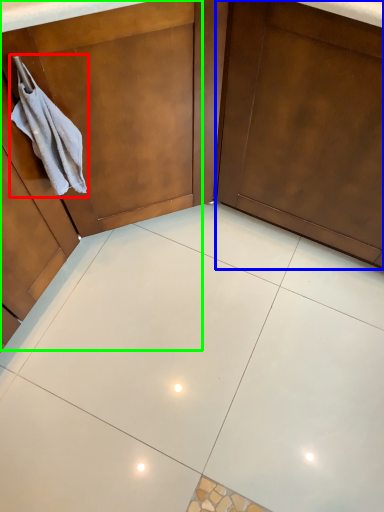
Question: Estimate the real-world distances between objects in this image. Which object is farther from hand towel (highlighted by a red box), door (highlighted by a blue box) or dresser (highlighted by a green box)?

Choices:
 (A) door
 (B) dresser

Answer: (A)